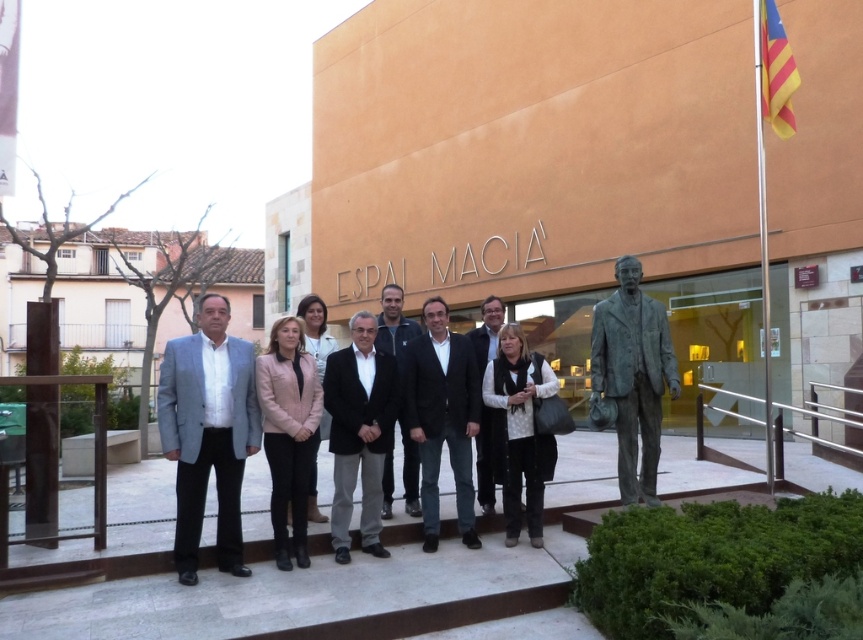
You are standing at the entrance of the building and want to greet the person in the black suit at center. Which direction should you walk to reach them?

The black suit at center is located at point 0.652 on the x axis and 0.513 on the y axis. Since you are at the entrance, which is below the steps, you should walk forward towards the steps and then to the right to reach the black suit at center.